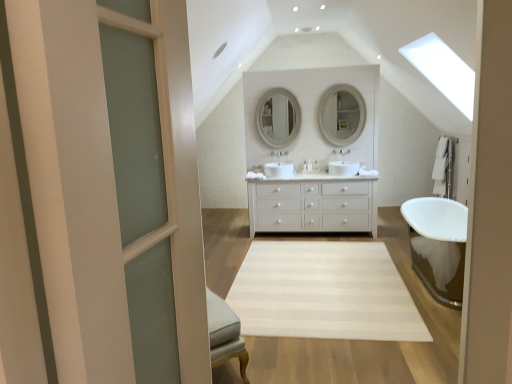
Question: Is clear glass door at left oriented towards white ceramic faucet at center?

Choices:
 (A) yes
 (B) no

Answer: (B)

Question: Considering the relative positions of clear glass door at left and white ceramic faucet at center in the image provided, is clear glass door at left behind white ceramic faucet at center?

Choices:
 (A) no
 (B) yes

Answer: (A)

Question: Does clear glass door at left have a larger size compared to white ceramic faucet at center?

Choices:
 (A) yes
 (B) no

Answer: (A)

Question: Is clear glass door at left turned away from white ceramic faucet at center?

Choices:
 (A) yes
 (B) no

Answer: (B)

Question: Considering the relative sizes of clear glass door at left and white ceramic faucet at center in the image provided, is clear glass door at left wider than white ceramic faucet at center?

Choices:
 (A) yes
 (B) no

Answer: (B)

Question: Does point (349, 94) appear closer or farther from the camera than point (347, 180)?

Choices:
 (A) farther
 (B) closer

Answer: (A)

Question: Considering their positions, is matte white mirror at upper center, the 2th mirror positioned from the left, located in front of or behind white matte cabinet at center?

Choices:
 (A) front
 (B) behind

Answer: (B)

Question: Which is correct: matte white mirror at upper center, the 2th mirror positioned from the left, is inside white matte cabinet at center, or outside of it?

Choices:
 (A) inside
 (B) outside

Answer: (B)

Question: Considering the relative positions of matte white mirror at upper center, arranged as the first mirror when viewed from the right, and white matte cabinet at center in the image provided, is matte white mirror at upper center, arranged as the first mirror when viewed from the right, to the left or to the right of white matte cabinet at center?

Choices:
 (A) right
 (B) left

Answer: (A)

Question: Would you say matte white mirror at center, positioned as the 2th mirror in right-to-left order, is inside or outside white ceramic faucet at center?

Choices:
 (A) outside
 (B) inside

Answer: (A)

Question: From their relative heights in the image, would you say matte white mirror at center, which is the first mirror from left to right, is taller or shorter than white ceramic faucet at center?

Choices:
 (A) tall
 (B) short

Answer: (A)

Question: Does point (287, 127) appear closer or farther from the camera than point (278, 150)?

Choices:
 (A) closer
 (B) farther

Answer: (A)

Question: From a real-world perspective, is matte white mirror at center, which is the first mirror from left to right, physically located above or below white ceramic faucet at center?

Choices:
 (A) below
 (B) above

Answer: (B)

Question: Looking at their shapes, would you say white matte cabinet at center is wider or thinner than matte white mirror at upper center, arranged as the first mirror when viewed from the right?

Choices:
 (A) thin
 (B) wide

Answer: (B)

Question: Is white matte cabinet at center in front of or behind matte white mirror at upper center, the 2th mirror positioned from the left, in the image?

Choices:
 (A) behind
 (B) front

Answer: (B)